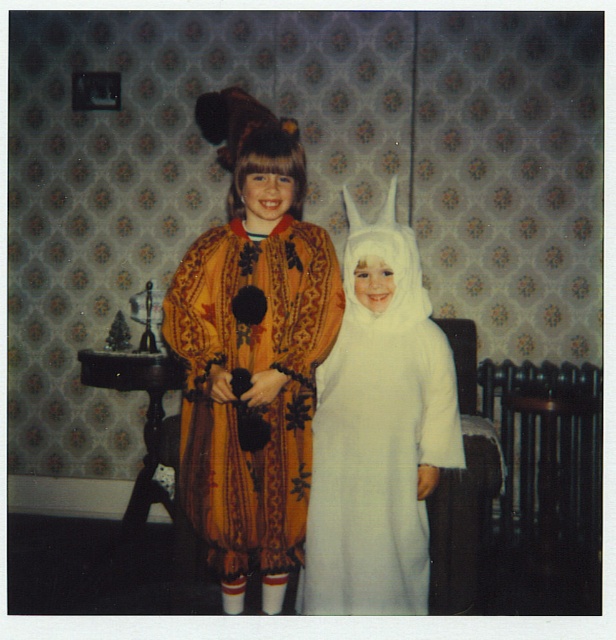
You are a photographer trying to capture a group photo of the velvet orange robe at center and the white fluffy costume at center. The camera you are using has a minimum focusing distance of 6 inches. Will you be able to take a clear photo of both subjects without moving the camera or the subjects?

The velvet orange robe at center is 5.52 inches away from the white fluffy costume at center. Since the camera requires a minimum focusing distance of 6 inches, the distance between them is too close. Therefore, you won

You are a photographer setting up for a photo shoot. You need to position the white fluffy costume at center and the golden velvet robe at center so that they are exactly 10 inches apart. Based on their current positions, do you need to move them closer together or farther apart?

The current distance between the white fluffy costume at center and the golden velvet robe at center is 8.83 inches. Since 8.83 inches is less than 10 inches, you need to move them farther apart to reach the desired distance of 10 inches.

You are a photographer trying to capture a photo of the two children in their costumes. You notice two points marked in the image. The first point is at coordinates point (x=375, y=433) and the second is at point (x=190, y=417). Which point is closer to the camera?

Point (x=375, y=433) is in front of point (x=190, y=417), so the first point is closer to the camera.